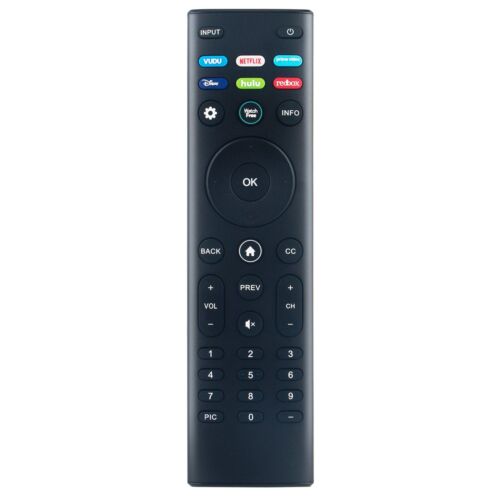
Identify the location of colored button.on remote control. (205, 64), (207, 83), (243, 82), (248, 58), (282, 59), (281, 85).